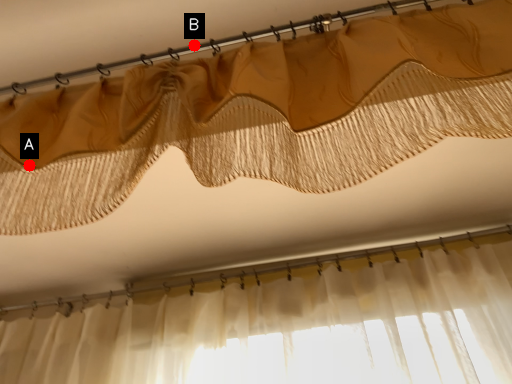
Question: Two points are circled on the image, labeled by A and B beside each circle. Which point is farther from the camera taking this photo?

Choices:
 (A) A is further
 (B) B is further

Answer: (B)